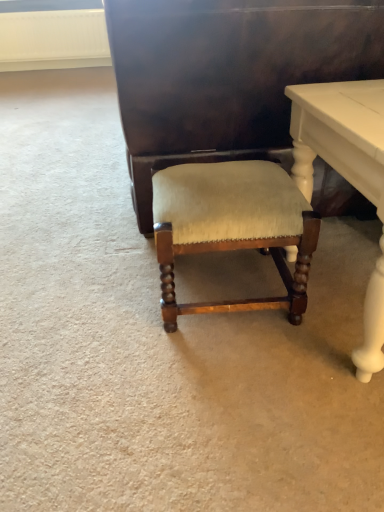
You are a GUI agent. You are given a task and a screenshot of the screen. Output one action in this format:
    pyautogui.click(x=<x>, y=<y>)
    Task: Click on the vacant area that is in front of suede-like beige cushion at center
    The image size is (384, 512).
    Given the screenshot: What is the action you would take?
    pyautogui.click(x=221, y=381)